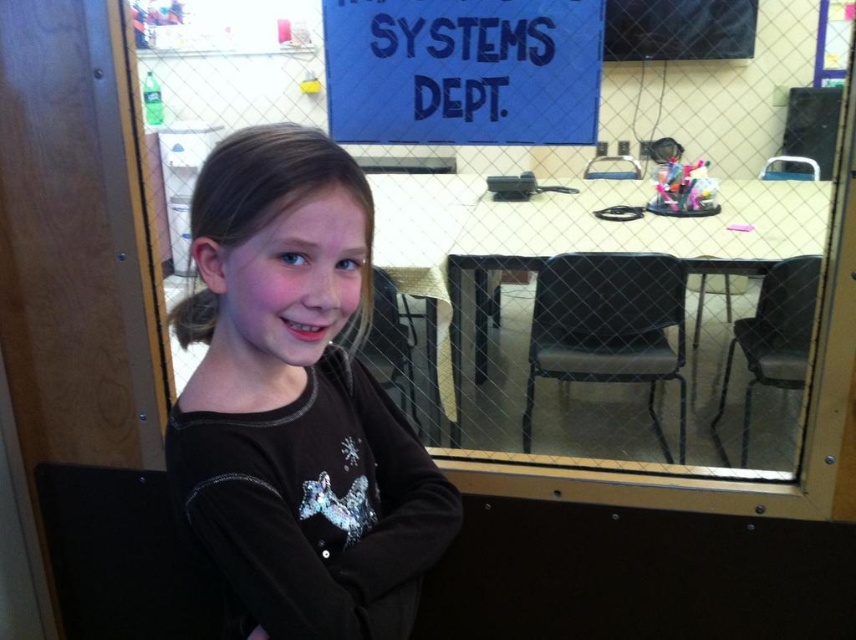
Does point (253, 454) lie in front of point (488, 28)?

Yes, point (253, 454) is closer to viewer.

Does dark brown fleece at center appear on the left side of blue fabric sign at upper center?

Correct, you'll find dark brown fleece at center to the left of blue fabric sign at upper center.

Is point (193, 490) positioned before point (520, 16)?

Yes, it is.

I want to click on dark brown fleece at center, so click(296, 401).